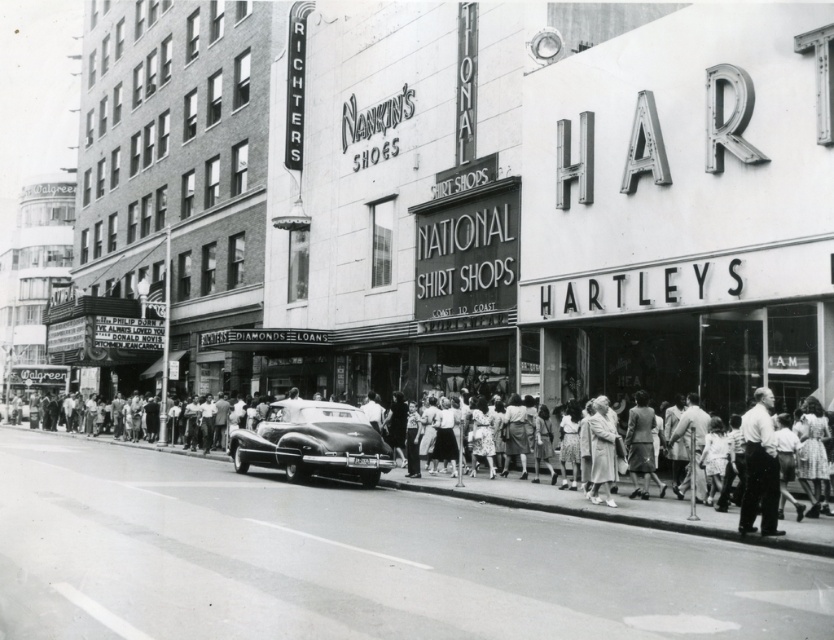
You are a pedestrian standing on the sidewalk in this urban scene. You notice a shiny black car at center and a white cotton shirt at center. Which object is closer to the ground?

The shiny black car at center is closer to the ground because it is positioned below the white cotton shirt at center.

Based on the scene description, where is the shiny black car at center located in the image?

The shiny black car at center is located at point (312, 442).

You are a delivery person standing at the edge of the street in the image. You need to place a package on the shiny black car at center and then deliver another item to the person wearing the white cotton shirt at center. Given that you can only move straight forward along the sidewalk, will you be able to reach both locations without changing your path?

The shiny black car at center and the white cotton shirt at center are 27.20 feet apart. Since you can only move straight forward along the sidewalk, you will pass by both locations sequentially. Therefore, you can first place the package on the shiny black car at center and then continue moving forward to deliver the item to the person wearing the white cotton shirt at center.